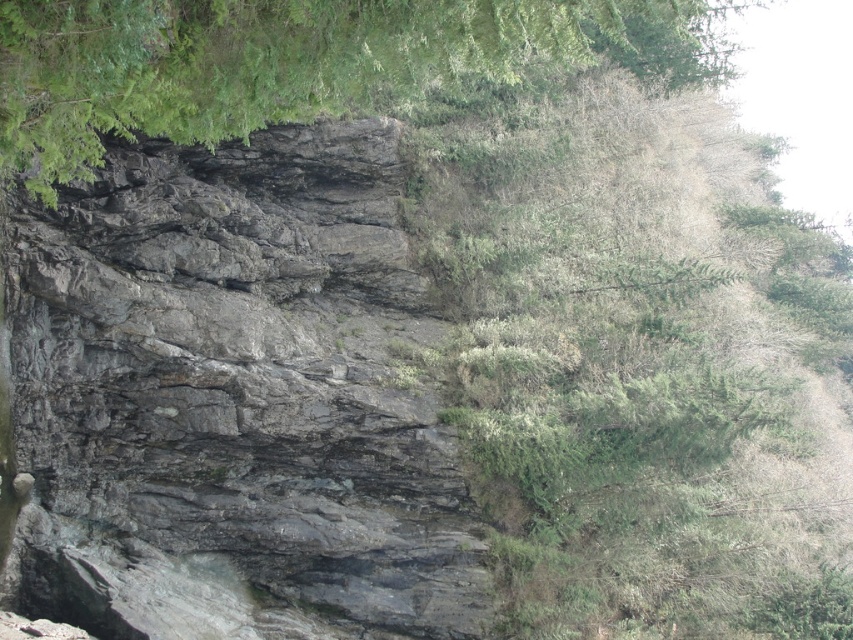
Is gray rock at center below green leafy tree at upper center?

Yes, gray rock at center is below green leafy tree at upper center.

Between point (70, 467) and point (170, 97), which one is positioned behind?

The point (70, 467) is more distant.

Identify the location of gray rock at center. This screenshot has height=640, width=853. coord(234,401).